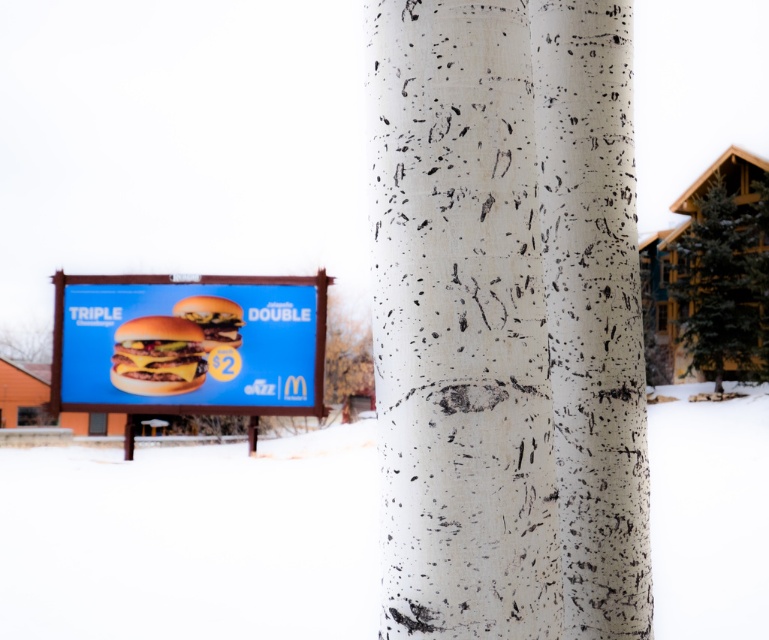
Can you confirm if white powdery snow at lower center is shorter than golden-brown crispy hamburger at center?

No, white powdery snow at lower center is not shorter than golden-brown crispy hamburger at center.

Who is more forward, (648, 458) or (202, 326)?

Positioned in front is point (648, 458).

Does point (698, 560) come behind point (198, 316)?

No, it is in front of (198, 316).

Where is `white powdery snow at lower center`? The width and height of the screenshot is (769, 640). white powdery snow at lower center is located at coordinates (191, 540).

Describe the element at coordinates (158, 355) in the screenshot. I see `cheeseburger with melted cheese at center` at that location.

Looking at this image, can you confirm if cheeseburger with melted cheese at center is positioned to the right of golden-brown crispy hamburger at center?

No, cheeseburger with melted cheese at center is not to the right of golden-brown crispy hamburger at center.

This screenshot has width=769, height=640. Find the location of `cheeseburger with melted cheese at center`. cheeseburger with melted cheese at center is located at coordinates (158, 355).

Image resolution: width=769 pixels, height=640 pixels. Identify the location of cheeseburger with melted cheese at center. (158, 355).

Who is positioned more to the left, blue cardboard billboard at center or cheeseburger with melted cheese at center?

Positioned to the left is cheeseburger with melted cheese at center.

Who is higher up, blue cardboard billboard at center or cheeseburger with melted cheese at center?

blue cardboard billboard at center is above.

Where is `blue cardboard billboard at center`? The width and height of the screenshot is (769, 640). blue cardboard billboard at center is located at coordinates (188, 342).